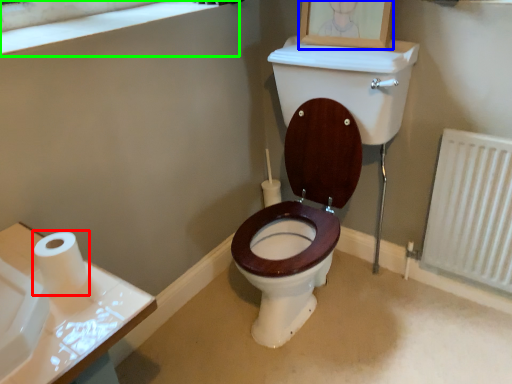
Question: Which object is the closest to the toilet paper (highlighted by a red box)? Choose among these: picture frame (highlighted by a blue box) or window frame (highlighted by a green box).

Choices:
 (A) picture frame
 (B) window frame

Answer: (B)